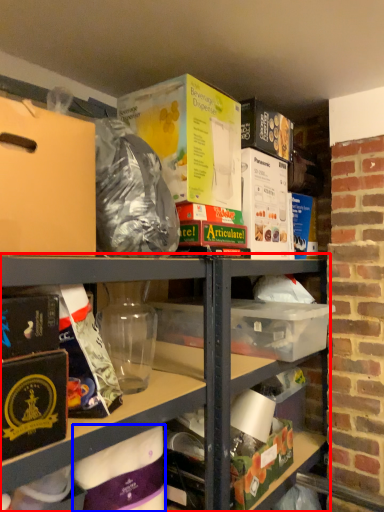
Question: Among these objects, which one is farthest to the camera, shelf (highlighted by a red box) or wrapping paper (highlighted by a blue box)?

Choices:
 (A) shelf
 (B) wrapping paper

Answer: (A)